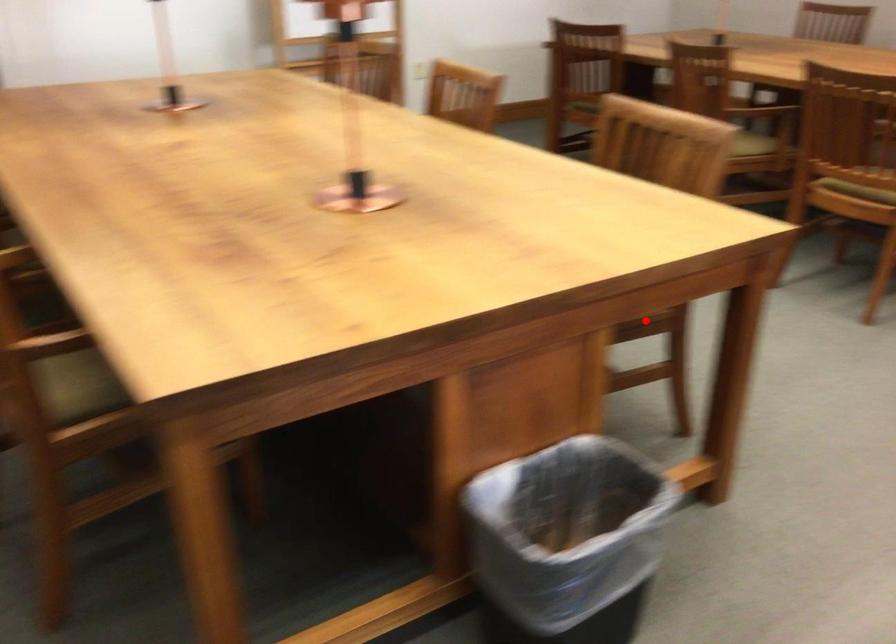
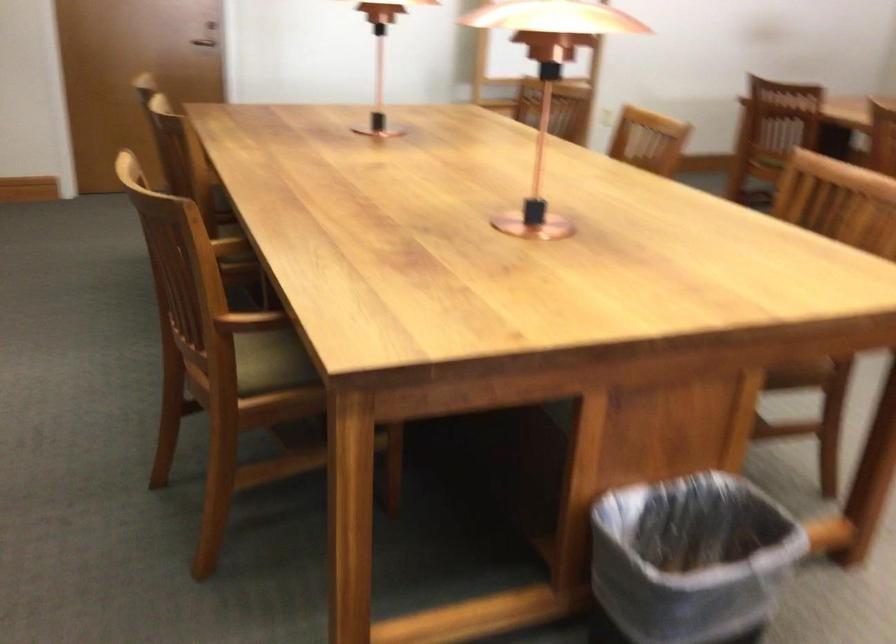
The point at the highlighted location is marked in the first image. Where is the corresponding point in the second image?

(799, 374)